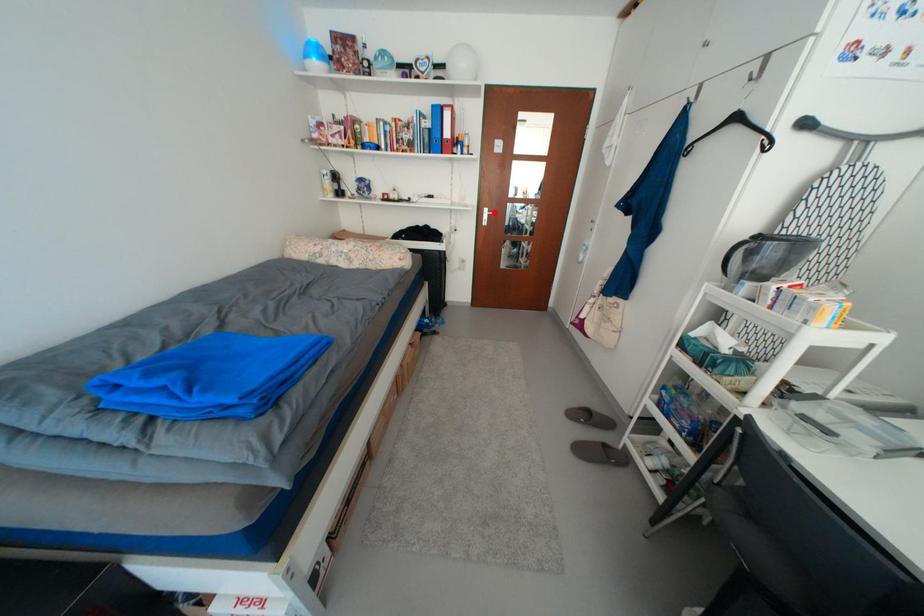
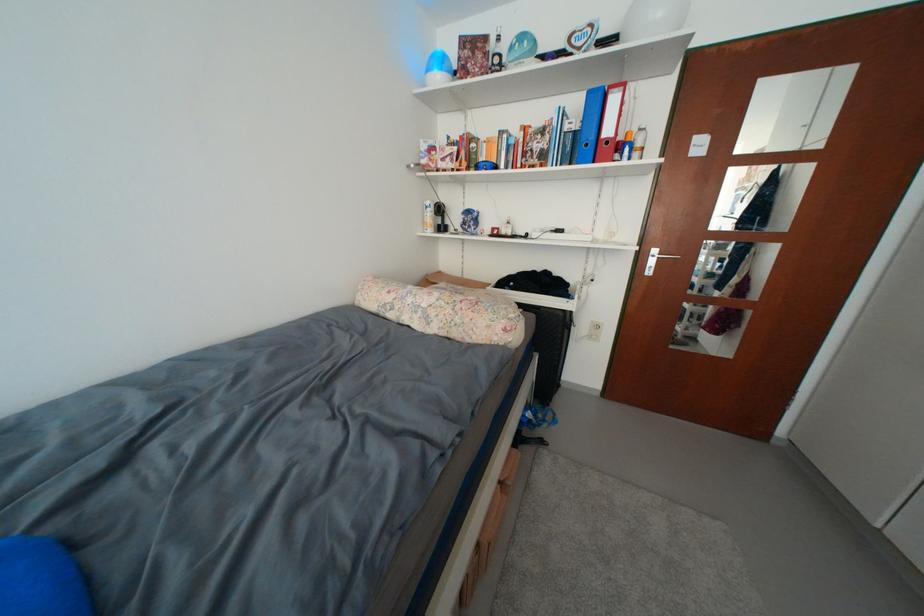
Question: I am providing you with two images of the same scene from different viewpoints. Image1 has a red point marked. In image2, the corresponding 3D location appears at what relative position? Reply with the corresponding letter.

Choices:
 (A) Closer
 (B) Farther

Answer: (B)